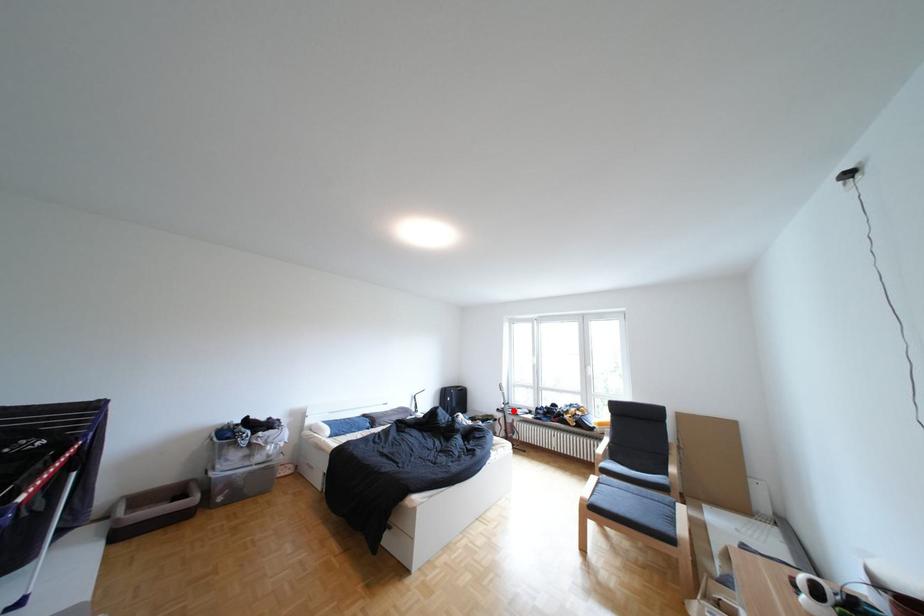
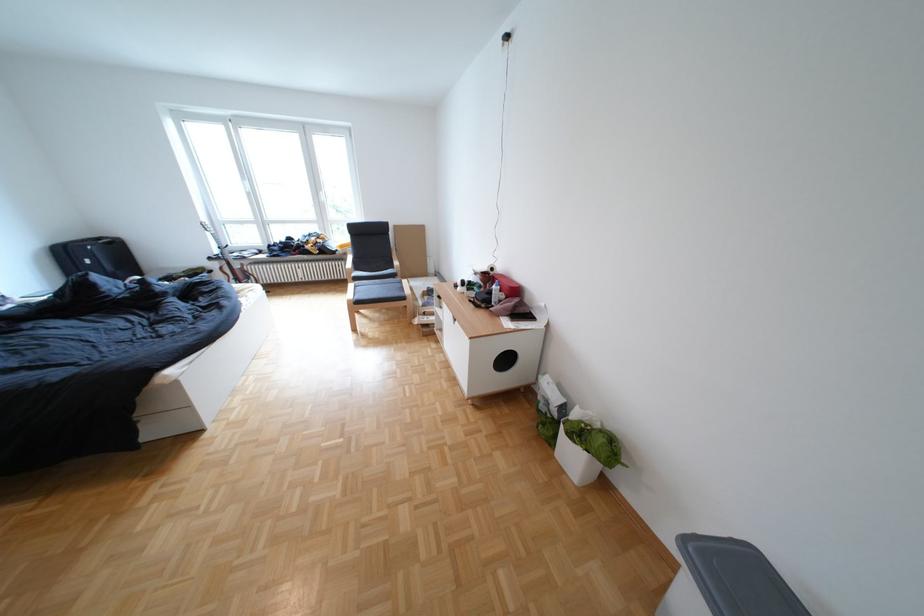
Question: I am providing you with two images of the same scene from different viewpoints. In image1, a red point is highlighted. Considering the same 3D point in image2, which of the following is correct?

Choices:
 (A) It is closer
 (B) It is farther

Answer: (A)